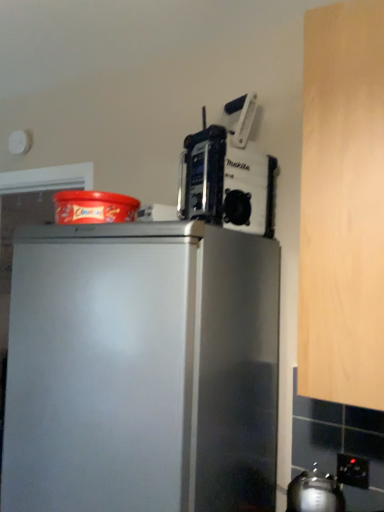
Question: Is metallic silver kettle at lower right behind black plastic electric outlet at lower right?

Choices:
 (A) no
 (B) yes

Answer: (A)

Question: From the image's perspective, is metallic silver kettle at lower right beneath black plastic electric outlet at lower right?

Choices:
 (A) no
 (B) yes

Answer: (B)

Question: Does metallic silver kettle at lower right appear on the left side of black plastic electric outlet at lower right?

Choices:
 (A) no
 (B) yes

Answer: (B)

Question: Does metallic silver kettle at lower right have a smaller size compared to black plastic electric outlet at lower right?

Choices:
 (A) yes
 (B) no

Answer: (B)

Question: Does metallic silver kettle at lower right appear on the right side of black plastic electric outlet at lower right?

Choices:
 (A) no
 (B) yes

Answer: (A)

Question: In the image, is black plastic electric outlet at lower right positioned in front of or behind metallic silver kettle at lower right?

Choices:
 (A) front
 (B) behind

Answer: (B)

Question: From the image's perspective, is black plastic electric outlet at lower right above or below metallic silver kettle at lower right?

Choices:
 (A) below
 (B) above

Answer: (B)

Question: Considering the relative positions of black plastic electric outlet at lower right and metallic silver kettle at lower right in the image provided, is black plastic electric outlet at lower right to the left or to the right of metallic silver kettle at lower right?

Choices:
 (A) right
 (B) left

Answer: (A)

Question: Is black plastic electric outlet at lower right wider or thinner than metallic silver kettle at lower right?

Choices:
 (A) thin
 (B) wide

Answer: (A)

Question: Is point (309, 482) closer or farther from the camera than point (187, 183)?

Choices:
 (A) closer
 (B) farther

Answer: (A)

Question: From the image's perspective, is metallic silver kettle at lower right located above or below metallic silver power tool at upper right?

Choices:
 (A) below
 (B) above

Answer: (A)

Question: Based on their positions, is metallic silver kettle at lower right located to the left or right of metallic silver power tool at upper right?

Choices:
 (A) left
 (B) right

Answer: (B)

Question: Considering the positions of metallic silver kettle at lower right and metallic silver power tool at upper right in the image, is metallic silver kettle at lower right taller or shorter than metallic silver power tool at upper right?

Choices:
 (A) short
 (B) tall

Answer: (A)

Question: In the image, is metallic silver power tool at upper right positioned in front of or behind metallic silver kettle at lower right?

Choices:
 (A) front
 (B) behind

Answer: (B)

Question: Would you say metallic silver power tool at upper right is inside or outside metallic silver kettle at lower right?

Choices:
 (A) outside
 (B) inside

Answer: (A)